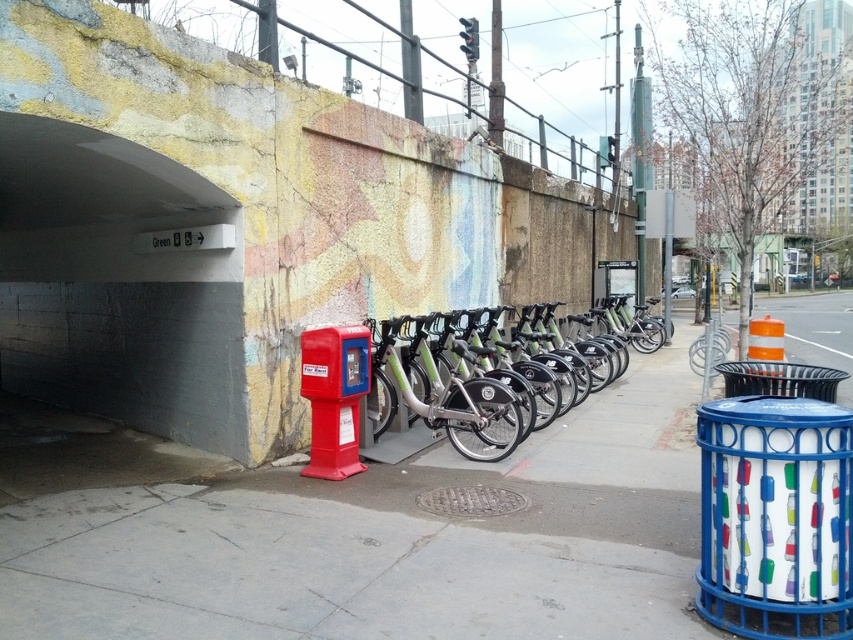
Question: Among these points, which one is farthest from the camera?

Choices:
 (A) (354, 417)
 (B) (367, 426)

Answer: (B)

Question: Which is nearer to the matte red phone box at center?

Choices:
 (A) silver metallic bicycle at center
 (B) gray concrete sidewalk at center

Answer: (A)

Question: From the image, what is the correct spatial relationship of matte red phone box at center in relation to silver metallic bicycle at center?

Choices:
 (A) below
 (B) above

Answer: (B)

Question: Is matte red phone box at center closer to camera compared to silver metallic bicycle at center?

Choices:
 (A) no
 (B) yes

Answer: (B)

Question: Does gray concrete sidewalk at center appear under silver metallic bicycle at center?

Choices:
 (A) no
 (B) yes

Answer: (B)

Question: Which point is closer to the camera taking this photo?

Choices:
 (A) (360, 384)
 (B) (688, 625)

Answer: (B)